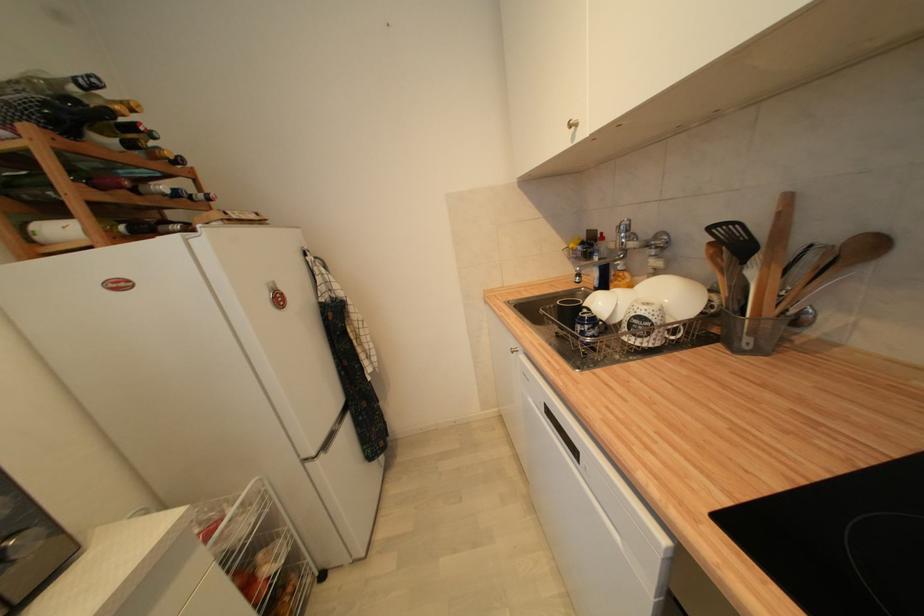
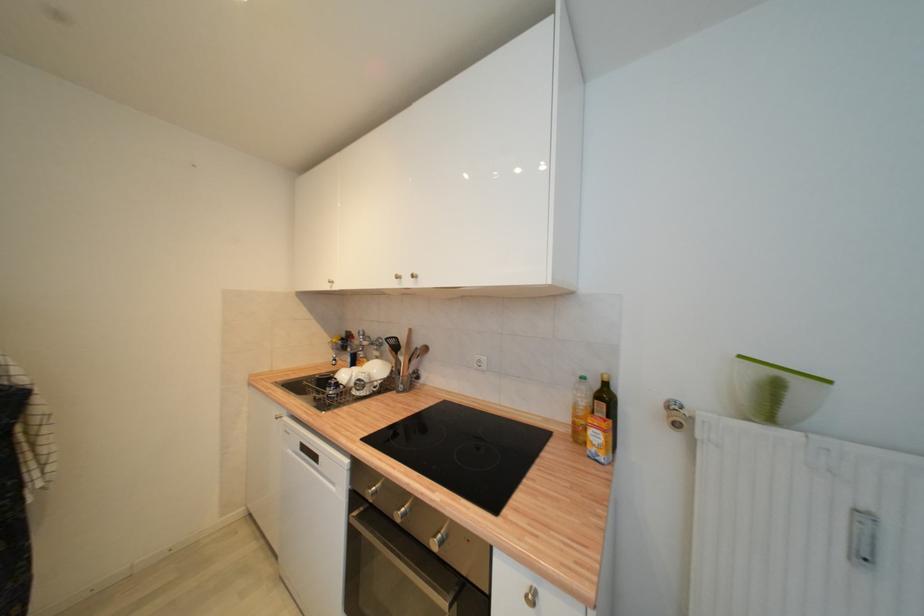
Locate, in the second image, the point that corresponds to point 715,230 in the first image.

(392, 341)